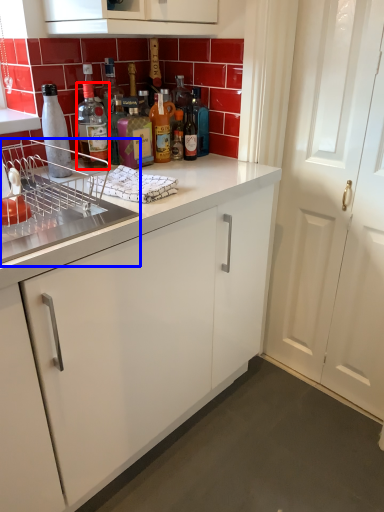
Question: Among these objects, which one is farthest to the camera, bottle (highlighted by a red box) or appliance (highlighted by a blue box)?

Choices:
 (A) bottle
 (B) appliance

Answer: (A)